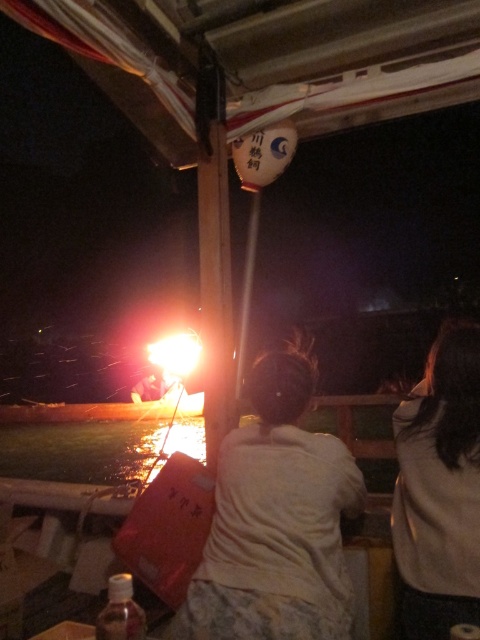
Question: Can you confirm if white cotton shirt at center is positioned below light brown hair at center?

Choices:
 (A) yes
 (B) no

Answer: (A)

Question: Does white cotton shirt at center have a larger size compared to light brown hair at center?

Choices:
 (A) yes
 (B) no

Answer: (A)

Question: Which point is closer to the camera?

Choices:
 (A) white cotton shirt at center
 (B) light brown hair at center

Answer: (A)

Question: Among these points, which one is nearest to the camera?

Choices:
 (A) (430, 516)
 (B) (193, 588)

Answer: (A)

Question: Can you confirm if white cotton shirt at center is thinner than light brown hair at center?

Choices:
 (A) yes
 (B) no

Answer: (B)